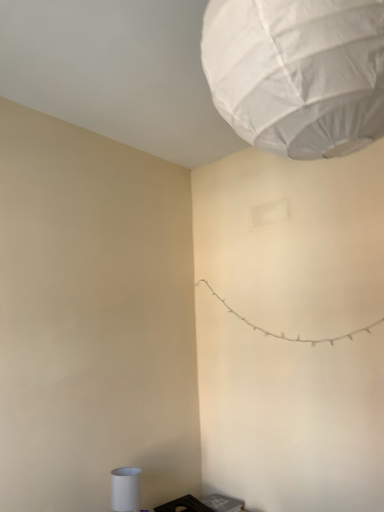
Question: Is the surface of black plastic laptop at lower right in direct contact with white fabric lantern at upper center?

Choices:
 (A) yes
 (B) no

Answer: (B)

Question: Can you confirm if black plastic laptop at lower right is taller than white fabric lantern at upper center?

Choices:
 (A) yes
 (B) no

Answer: (B)

Question: Would you say black plastic laptop at lower right is outside white fabric lantern at upper center?

Choices:
 (A) no
 (B) yes

Answer: (B)

Question: From a real-world perspective, is black plastic laptop at lower right located higher than white fabric lantern at upper center?

Choices:
 (A) no
 (B) yes

Answer: (A)

Question: From the image's perspective, does black plastic laptop at lower right appear lower than white fabric lantern at upper center?

Choices:
 (A) no
 (B) yes

Answer: (B)

Question: Does black plastic laptop at lower right have a lesser width compared to white fabric lantern at upper center?

Choices:
 (A) no
 (B) yes

Answer: (B)

Question: Can you confirm if white matte cylinder at lower left is thinner than white fabric lantern at upper center?

Choices:
 (A) no
 (B) yes

Answer: (B)

Question: From the image's perspective, is white matte cylinder at lower left above white fabric lantern at upper center?

Choices:
 (A) no
 (B) yes

Answer: (A)

Question: Is white matte cylinder at lower left facing away from white fabric lantern at upper center?

Choices:
 (A) yes
 (B) no

Answer: (B)

Question: Does white matte cylinder at lower left appear on the left side of white fabric lantern at upper center?

Choices:
 (A) yes
 (B) no

Answer: (A)

Question: From a real-world perspective, is white matte cylinder at lower left located higher than white fabric lantern at upper center?

Choices:
 (A) yes
 (B) no

Answer: (B)

Question: Considering the relative positions of white matte cylinder at lower left and white fabric lantern at upper center in the image provided, is white matte cylinder at lower left to the right of white fabric lantern at upper center from the viewer's perspective?

Choices:
 (A) yes
 (B) no

Answer: (B)

Question: From a real-world perspective, is white fabric lantern at upper center positioned under black plastic laptop at lower right based on gravity?

Choices:
 (A) no
 (B) yes

Answer: (A)